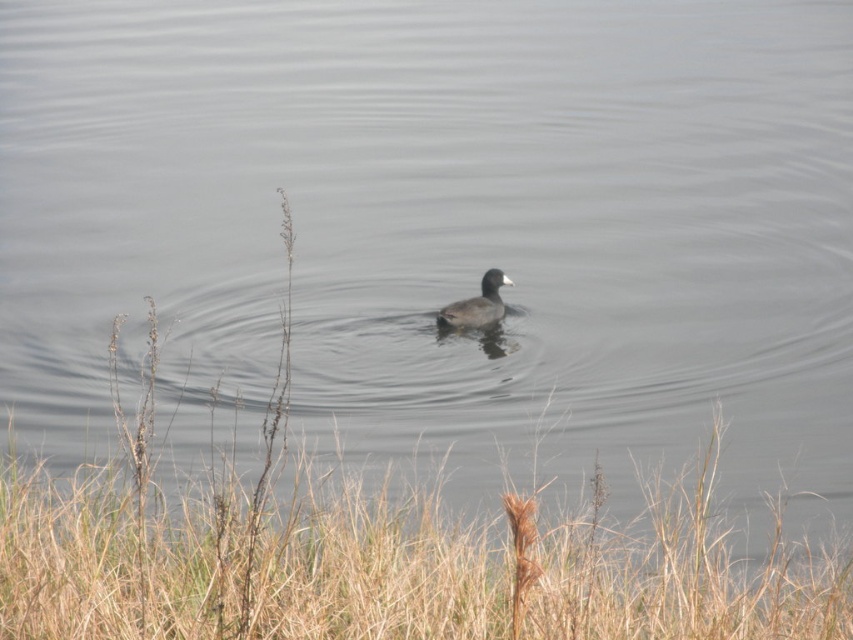
Question: Which point is farther to the camera?

Choices:
 (A) (300, 522)
 (B) (467, 310)

Answer: (B)

Question: Does dry grass at lower center appear on the right side of dark brown feathers at center?

Choices:
 (A) no
 (B) yes

Answer: (A)

Question: Is dry grass at lower center further to the viewer compared to dark brown feathers at center?

Choices:
 (A) yes
 (B) no

Answer: (B)

Question: Considering the relative positions of dry grass at lower center and dark brown feathers at center in the image provided, where is dry grass at lower center located with respect to dark brown feathers at center?

Choices:
 (A) above
 (B) below

Answer: (B)

Question: Which of the following is the closest to the observer?

Choices:
 (A) (434, 316)
 (B) (1, 609)

Answer: (B)